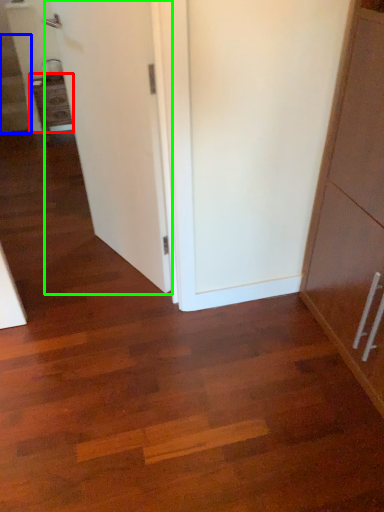
Question: Estimate the real-world distances between objects in this image. Which object is farther from cabinetry (highlighted by a red box), stairwell (highlighted by a blue box) or door (highlighted by a green box)?

Choices:
 (A) stairwell
 (B) door

Answer: (B)